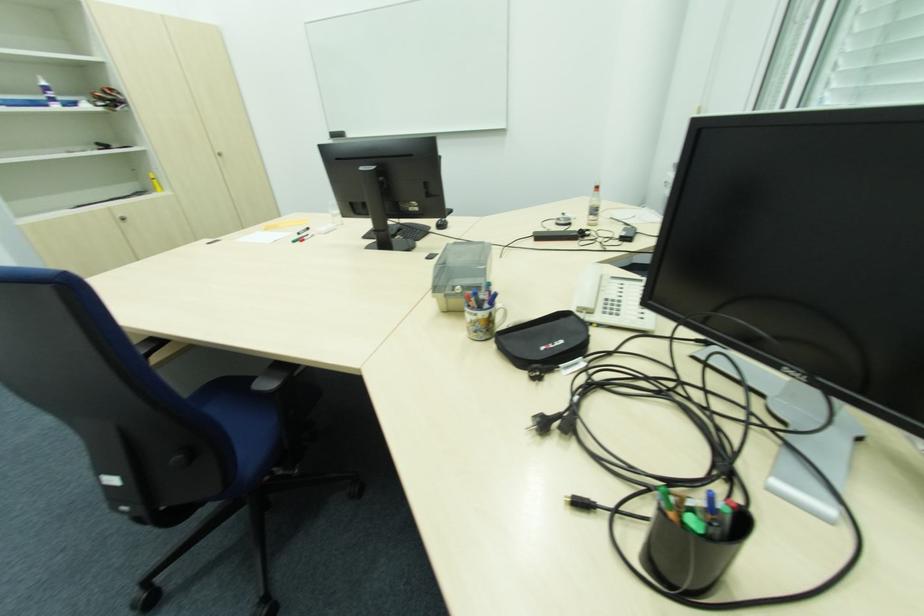
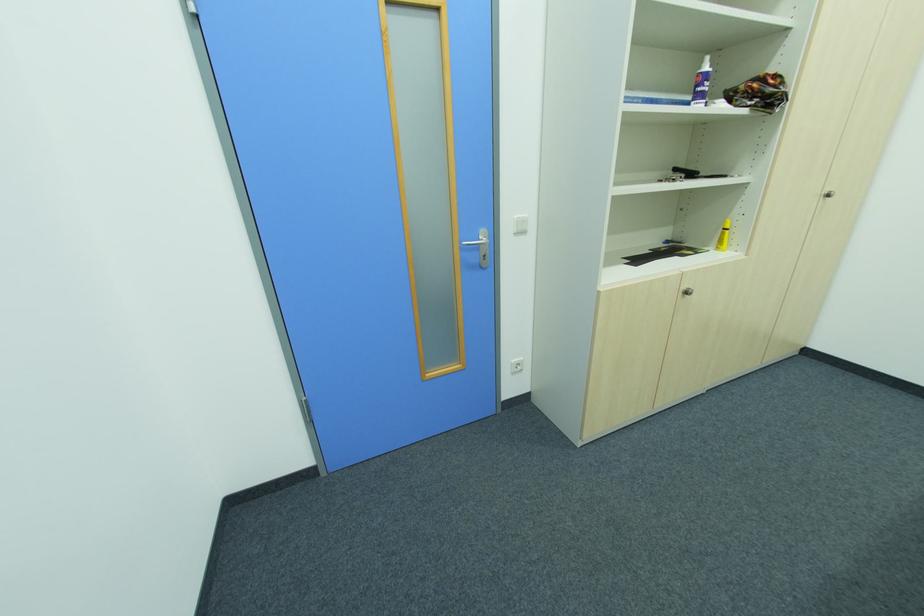
In the second image, find the point that corresponds to pixel 49 90 in the first image.

(708, 78)